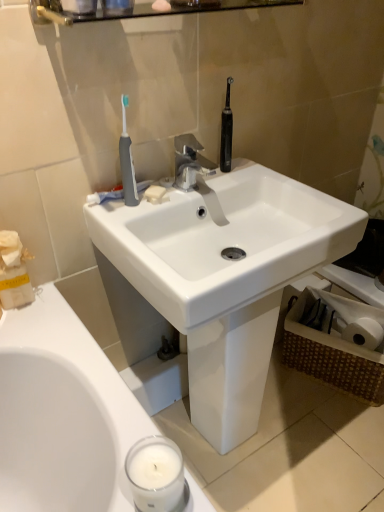
Question: From the image's perspective, is gray rubber toothbrush at upper left located above or below white glossy sink at center?

Choices:
 (A) below
 (B) above

Answer: (B)

Question: Visually, is gray rubber toothbrush at upper left positioned to the left or to the right of white glossy sink at center?

Choices:
 (A) left
 (B) right

Answer: (A)

Question: Estimate the real-world distances between objects in this image. Which object is farther from the white glossy sink at center?

Choices:
 (A) white paper tissue at upper left
 (B) glossy glass shelf at upper center
 (C) white matte soap at sink center
 (D) silver metallic faucet at center
 (E) gray rubber toothbrush at upper left

Answer: (B)

Question: Which object is positioned closest to the white glossy sink at center?

Choices:
 (A) silver metallic faucet at center
 (B) gray rubber toothbrush at upper left
 (C) white matte soap at sink center
 (D) glossy glass shelf at upper center
 (E) white paper tissue at upper left

Answer: (A)